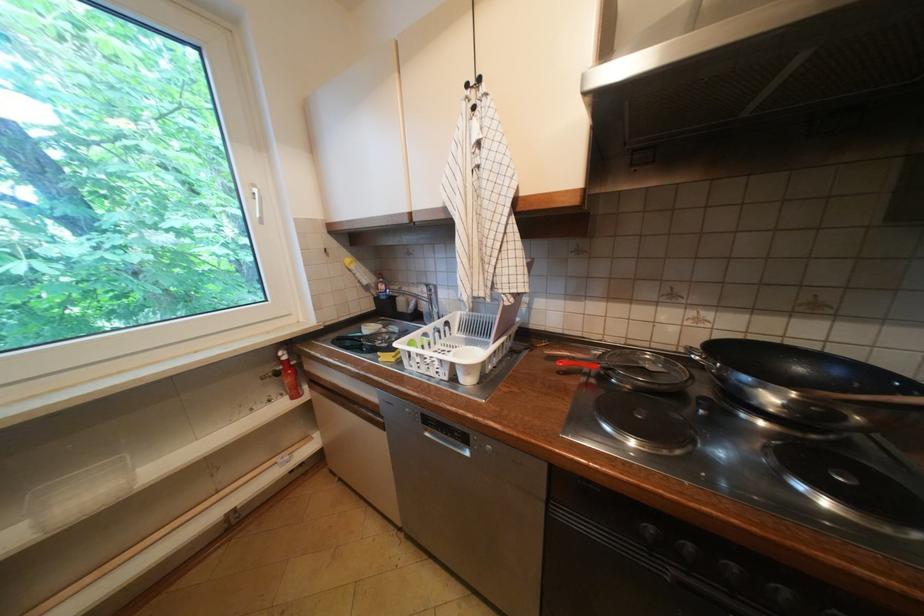
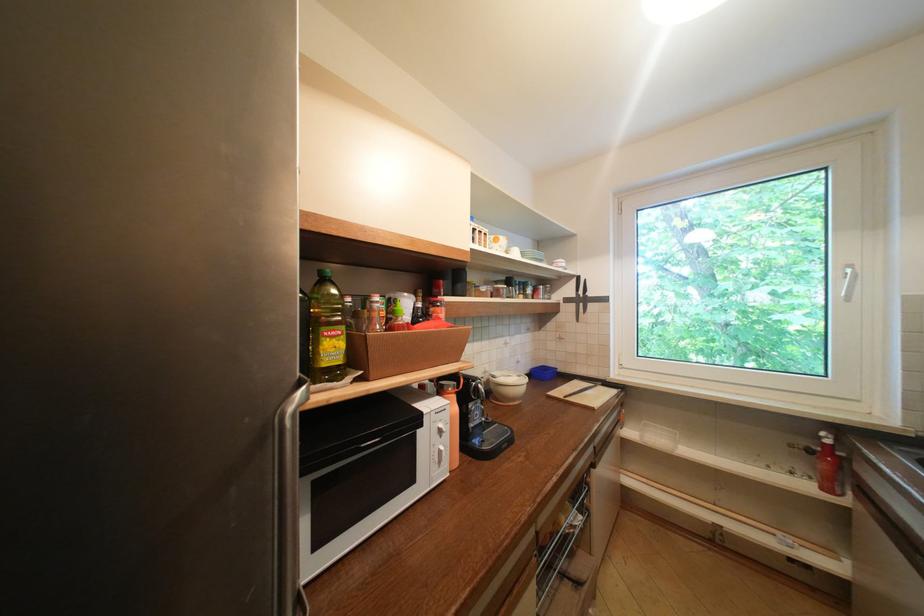
The point at (287, 359) is marked in the first image. Where is the corresponding point in the second image?

(829, 439)